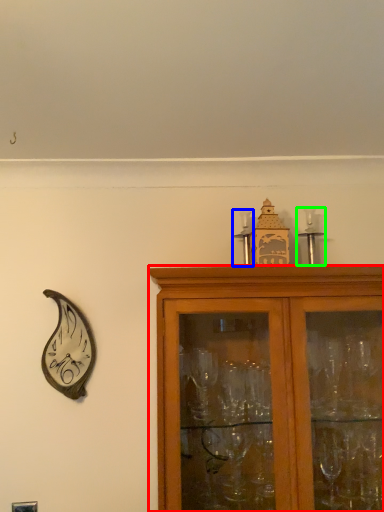
Question: Which object is positioned farthest from cabinetry (highlighted by a red box)? Select from candle holder (highlighted by a blue box) and candle holder (highlighted by a green box).

Choices:
 (A) candle holder
 (B) candle holder

Answer: (A)